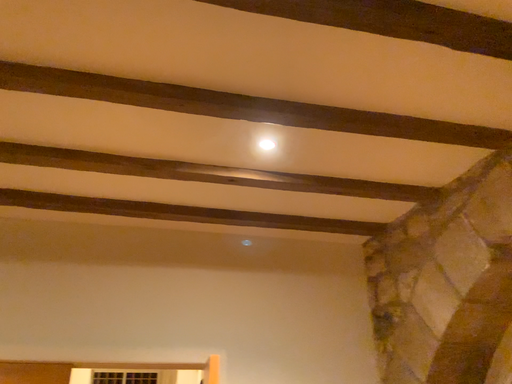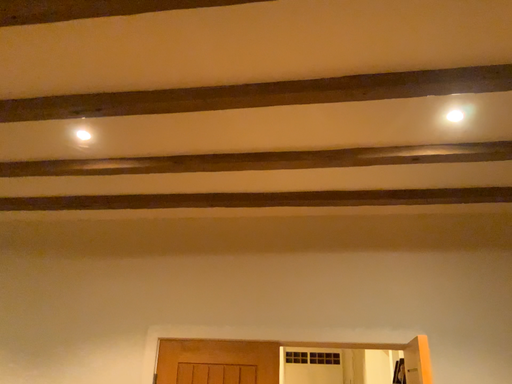
Question: Which way did the camera rotate in the video?

Choices:
 (A) rotated left
 (B) rotated right

Answer: (A)